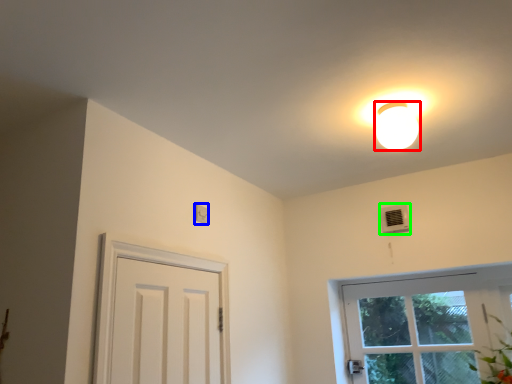
Question: Estimate the real-world distances between objects in this image. Which object is closer to lamp (highlighted by a red box), light switch (highlighted by a blue box) or air conditioner (highlighted by a green box)?

Choices:
 (A) light switch
 (B) air conditioner

Answer: (B)